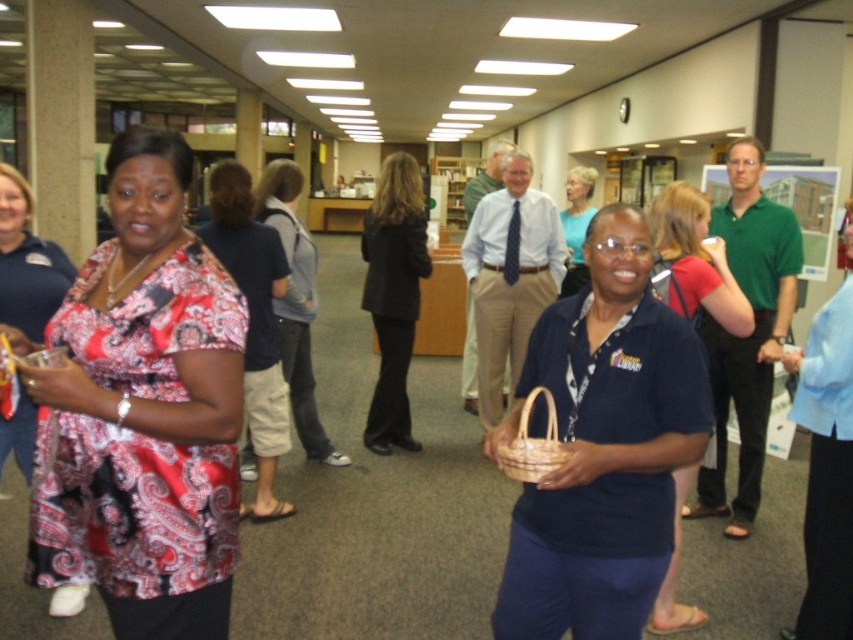
Question: Estimate the real-world distances between objects in this image. Which object is closer to the dark gray suit at center?

Choices:
 (A) silky paisley blouse at center
 (B) patterned silk blouse at left

Answer: (B)

Question: Which object appears farthest from the camera in this image?

Choices:
 (A) woven brown basket at center
 (B) dark gray suit at center

Answer: (B)

Question: Is paisley fabric blouse at left above patterned silk blouse at left?

Choices:
 (A) yes
 (B) no

Answer: (A)

Question: Which of the following is the closest to the observer?

Choices:
 (A) (583, 228)
 (B) (537, 444)
 (C) (641, 531)

Answer: (C)

Question: Does dark gray suit at center appear under blue knit sweater at center?

Choices:
 (A) yes
 (B) no

Answer: (A)

Question: Does navy blue shirt at center appear on the left side of dark gray suit at center?

Choices:
 (A) no
 (B) yes

Answer: (A)